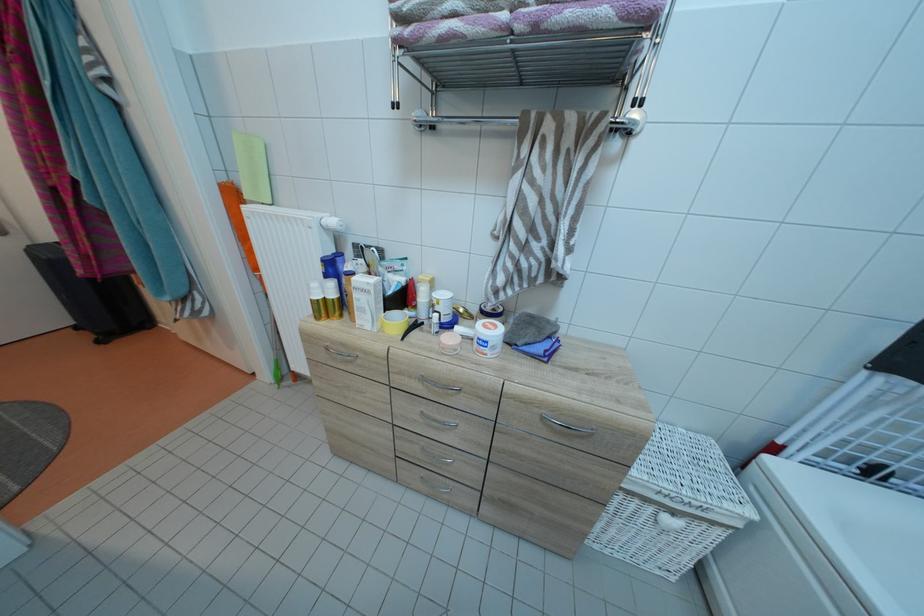
At what (x,y) coordinates should I click in order to perform the action: click on white radiator knob. Please return your answer as a coordinate pair (x, y). Looking at the image, I should click on (333, 224).